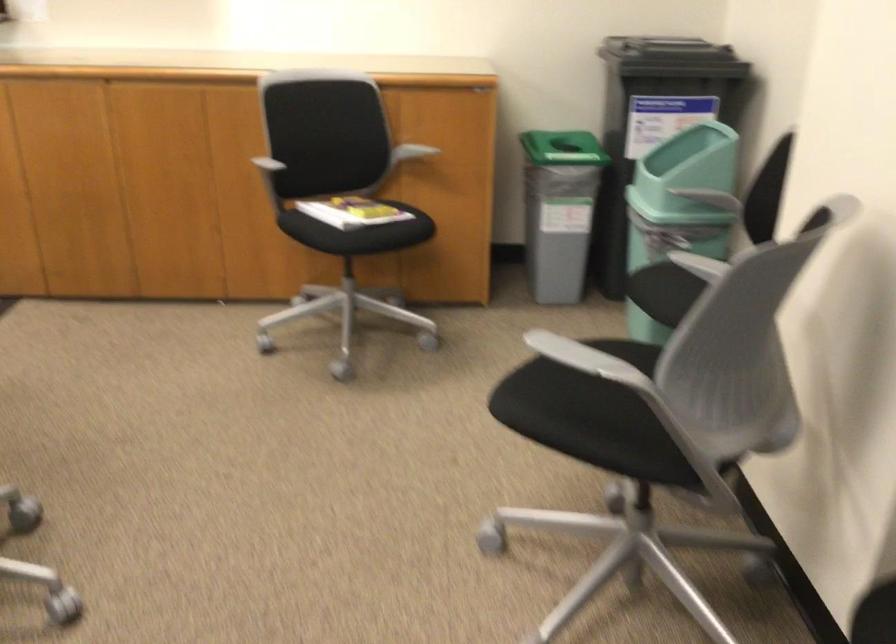
Describe the element at coordinates (351, 211) in the screenshot. I see `the black bin lid` at that location.